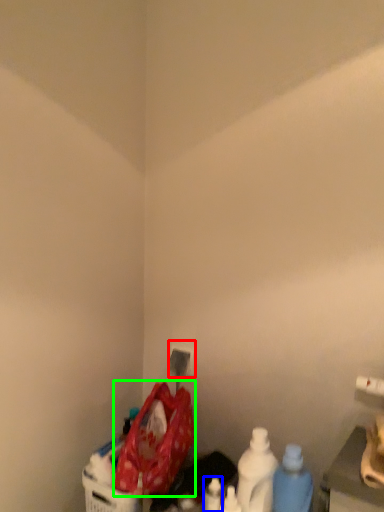
Question: Considering the real-world distances, which object is closest to electric outlet (highlighted by a red box)? bottle (highlighted by a blue box) or waste (highlighted by a green box).

Choices:
 (A) bottle
 (B) waste

Answer: (B)